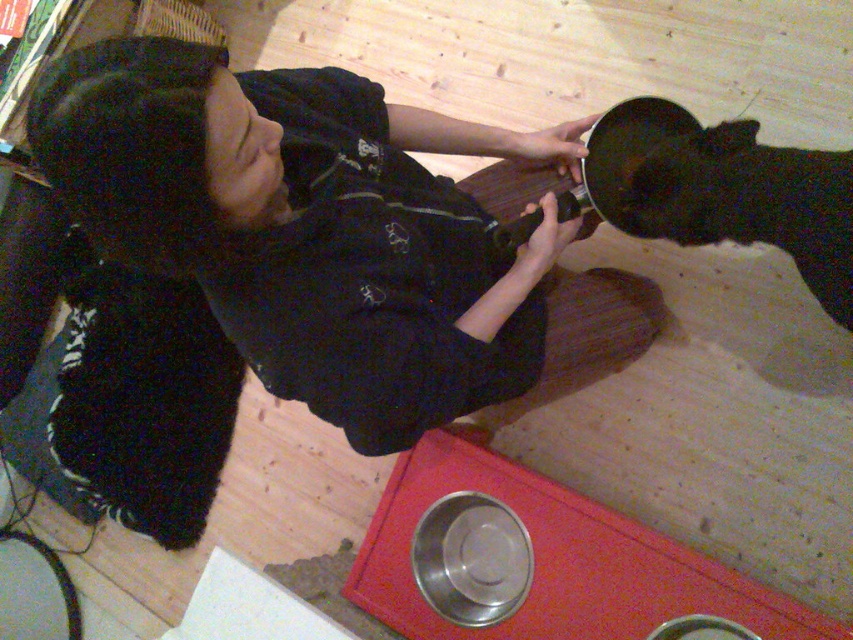
You are a photographer trying to capture a clear shot of the black cotton shirt at upper center and the black fur pet at lower right. Since both are black, you need to adjust your focus based on their positions. Which object should you focus on first to ensure it appears sharp in the photo?

The black cotton shirt at upper center is closer to the viewer than the black fur pet at lower right, so you should focus on the black cotton shirt at upper center first to ensure it appears sharp.

You are a fashion designer analyzing the image. Where is the black cotton shirt at upper center positioned in relation to the other elements in the scene?

The black cotton shirt at upper center is located at point coordinates of 0.353 in the x and 0.362 in the y.

You are a photographer trying to capture a closeup of the black cotton shirt at upper center and the black fur pet at lower right. Since both are black, you need to adjust your camera focus to distinguish them. Which object should you focus on first to ensure it appears sharp in the photo?

The black cotton shirt at upper center is located below the black fur pet at lower right, so focusing on the black fur pet at lower right first would ensure it stays sharp as it is closer to the camera.